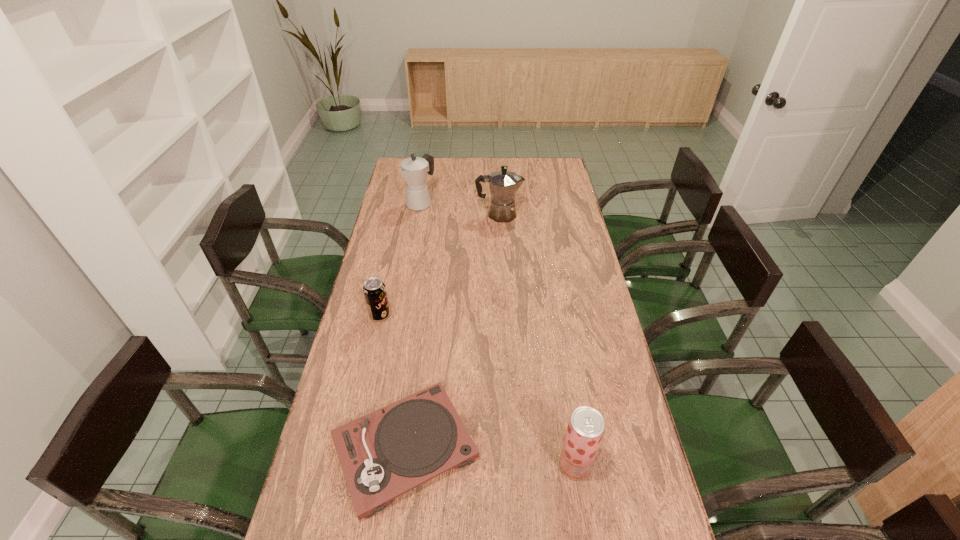
Locate an element on the screen. The image size is (960, 540). free region located 0.250m on the right of the phonograph_record is located at coordinates (574, 448).

Image resolution: width=960 pixels, height=540 pixels. In order to click on coffeepot that is at the left edge in this screenshot , I will do `click(414, 170)`.

Find the location of a particular element. This screenshot has width=960, height=540. soda can located at the left edge is located at coordinates (374, 290).

Locate an element on the screen. The width and height of the screenshot is (960, 540). phonograph_record present at the left edge is located at coordinates (384, 454).

The image size is (960, 540). In order to click on object that is positioned at the right edge in this screenshot , I will do `click(586, 426)`.

The height and width of the screenshot is (540, 960). What are the coordinates of `vacant space at the far edge` in the screenshot? It's located at (471, 178).

Find the location of a particular element. This screenshot has width=960, height=540. free location at the left edge is located at coordinates (353, 328).

The width and height of the screenshot is (960, 540). In order to click on vacant space at the right edge in this screenshot , I will do `click(588, 322)`.

In the image, there is a desktop. Where is `vacant region at the far right corner`? This screenshot has width=960, height=540. vacant region at the far right corner is located at coordinates (561, 172).

Identify the location of free space between the right coffeepot and the fruit juice. (537, 340).